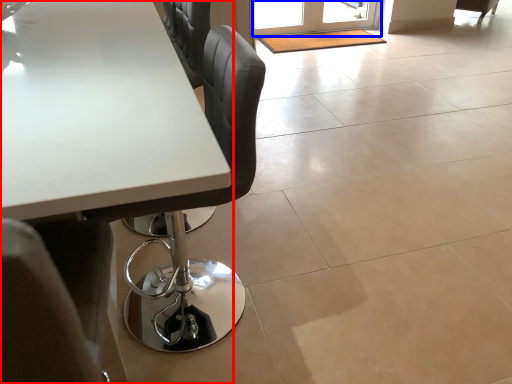
Question: Which object appears closest to the camera in this image, table (highlighted by a red box) or screen door (highlighted by a blue box)?

Choices:
 (A) table
 (B) screen door

Answer: (A)